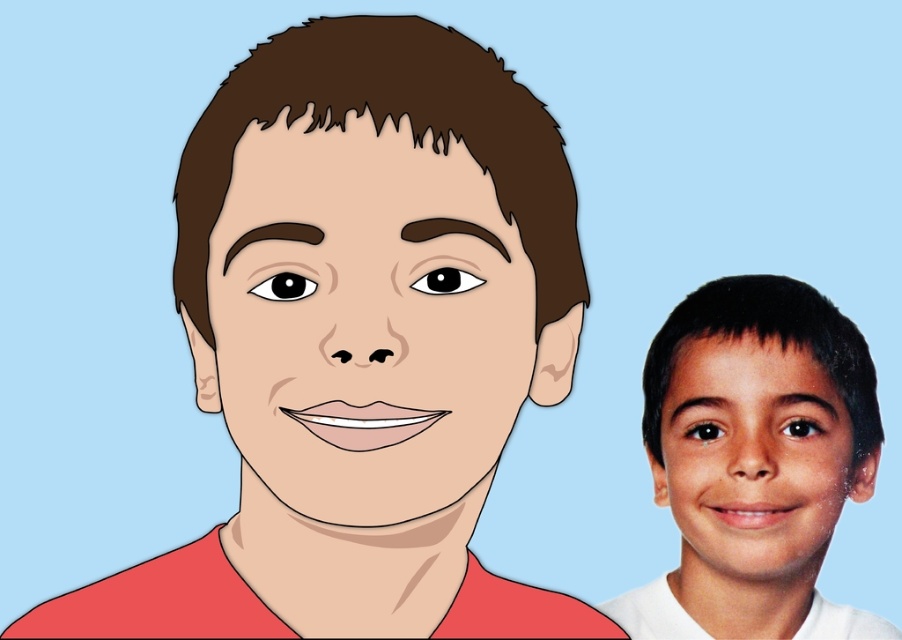
You are an artist trying to create a balanced composition. You have a matte red shirt at center and a smooth skin child at right in your artwork. Which object should you adjust in size to achieve balance, and why?

The smooth skin child at right should be adjusted because the matte red shirt at center is wider, so increasing the child or decreasing the shirt would balance the composition.

You are an artist trying to paint a portrait. You have to place the matte red shirt at center and the smooth skin face at center on a canvas. Given that the canvas is 1.5 inches wide, will both fit side by side without overlapping?

The matte red shirt at center and smooth skin face at center are 1.08 inches apart from each other. Since the total width required is 1.08 inches and the canvas is 1.5 inches wide, they can fit side by side without overlapping.

You are an artist setting up a display for an art exhibition. You have two items to place on a wall. The first is a painting of a person wearing a matte red shirt at center, and the second is a photograph of a smooth skin child at right. The wall space you have is 40 centimeters wide. Can both items fit side by side without overlapping?

The distance between the matte red shirt at center and smooth skin child at right is 41.18 centimeters. Since the wall space is only 40 centimeters wide, the two items cannot fit side by side without overlapping.